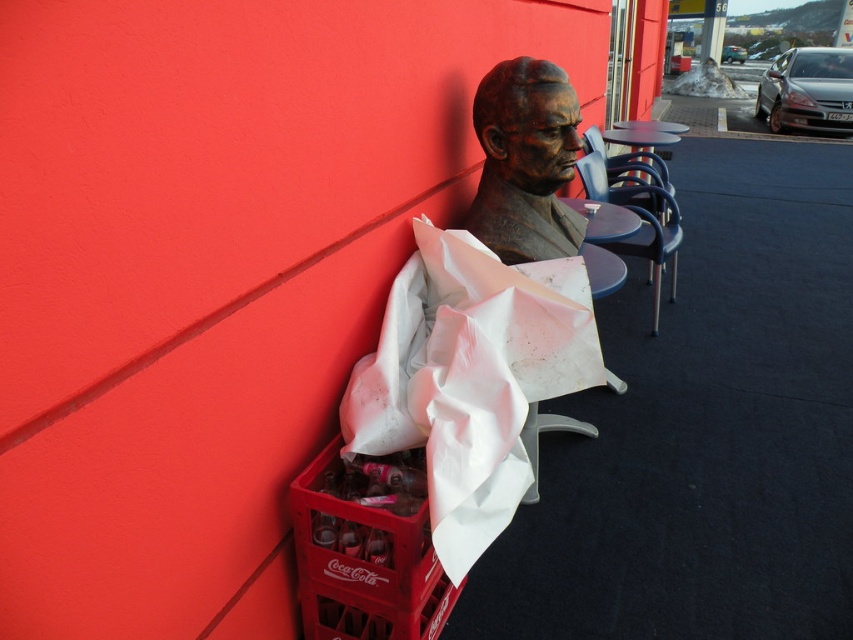
You are a visitor at this outdoor area and want to take a photo of the bronze bust at center and the metallic blue chair at center. Which object should you focus on first if you want to capture both in the same frame without moving the camera?

You should focus on the bronze bust at center first because it is closer to the viewer than the metallic blue chair at center, ensuring both are in focus when using a camera with a fixed focal point.